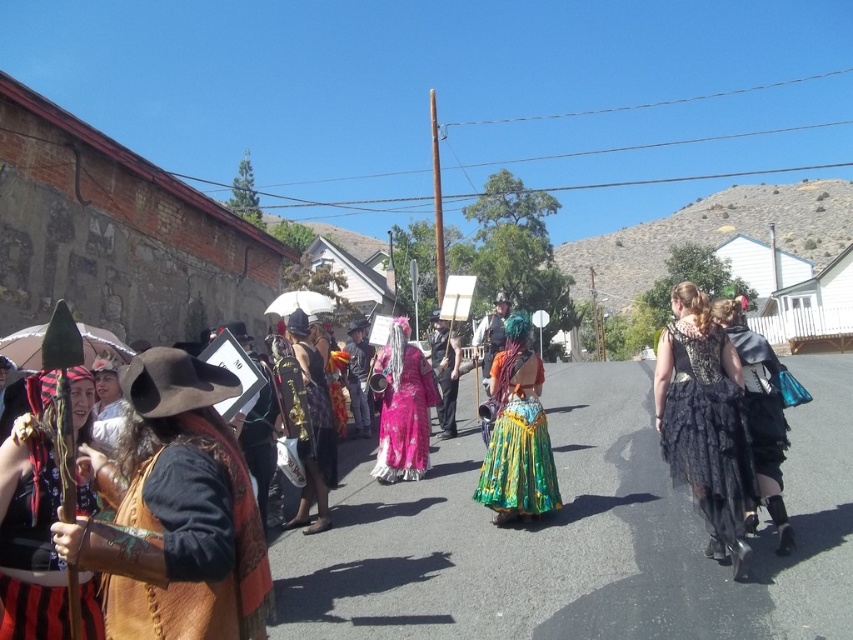
From the picture: Can you confirm if shiny green fabric skirt at center is smaller than leather vest at left?

Correct, shiny green fabric skirt at center occupies less space than leather vest at left.

Which is in front, point (515, 353) or point (260, 595)?

Positioned in front is point (260, 595).

Find the location of `shiny green fabric skirt at center`. shiny green fabric skirt at center is located at coordinates point(517,433).

Which is below, velvet black dress at center or leather vest at left?

velvet black dress at center is below.

Between velvet black dress at center and leather vest at left, which one has more height?

leather vest at left

Does point (776, 428) lie behind point (241, 518)?

That is True.

Identify the location of velvet black dress at center. The height and width of the screenshot is (640, 853). (759, 410).

Does shiny green fabric skirt at center lie behind translucent pink umbrella at left?

Yes, shiny green fabric skirt at center is behind translucent pink umbrella at left.

From the picture: Can you confirm if shiny green fabric skirt at center is bigger than translucent pink umbrella at left?

No.

Find the location of `shiny green fabric skirt at center`. shiny green fabric skirt at center is located at coordinates (517, 433).